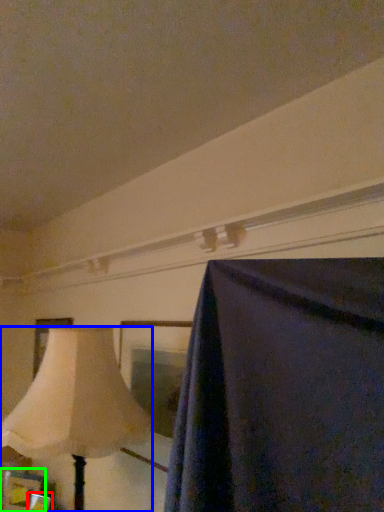
Question: Based on their relative distances, which object is farther from picture frame (highlighted by a red box)? Choose from lamp (highlighted by a blue box) and picture frame (highlighted by a green box).

Choices:
 (A) lamp
 (B) picture frame

Answer: (A)